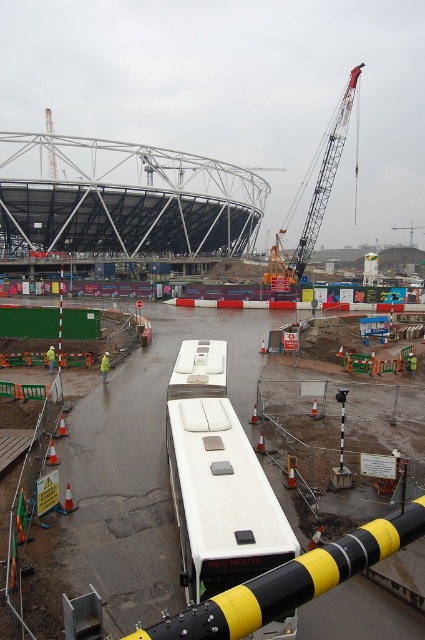
Question: Can you confirm if white rubber bus at center is thinner than metallic gray crane at upper right?

Choices:
 (A) yes
 (B) no

Answer: (A)

Question: Does white rubber bus at center appear over metallic gray crane at upper right?

Choices:
 (A) yes
 (B) no

Answer: (B)

Question: Does white rubber bus at center appear on the left side of metallic gray crane at upper right?

Choices:
 (A) no
 (B) yes

Answer: (B)

Question: Which object appears closest to the camera in this image?

Choices:
 (A) white rubber bus at center
 (B) metallic gray crane at upper right

Answer: (A)